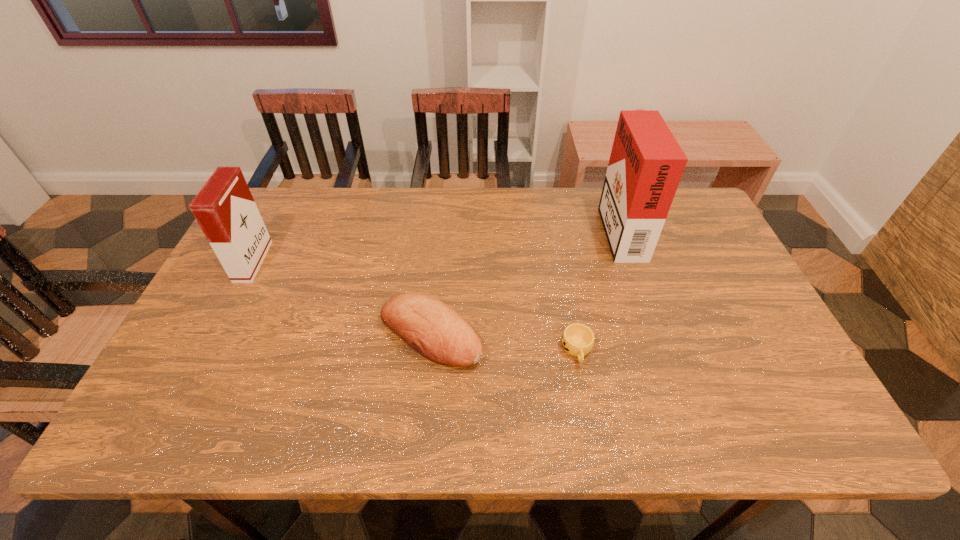
Point out which object is positioned as the third nearest to the bread. Please provide its 2D coordinates. Your answer should be formatted as a tuple, i.e. [(x, y)], where the tuple contains the x and y coordinates of a point satisfying the conditions above.

[(646, 164)]

Choose which object is the third nearest neighbor to the bread. Please provide its 2D coordinates. Your answer should be formatted as a tuple, i.e. [(x, y)], where the tuple contains the x and y coordinates of a point satisfying the conditions above.

[(646, 164)]

You are a GUI agent. You are given a task and a screenshot of the screen. Output one action in this format:
    pyautogui.click(x=<x>, y=<y>)
    Task: Click on the free space in the image that satisfies the following two spatial constraints: 1. on the front-facing side of the shorter cigarette_case; 2. on the left side of the shortest object
    
    Given the screenshot: What is the action you would take?
    pyautogui.click(x=207, y=350)

I want to click on vacant space that satisfies the following two spatial constraints: 1. on the front-facing side of the left cigarette_case; 2. on the left side of the cup, so click(207, 350).

This screenshot has width=960, height=540. I want to click on free location that satisfies the following two spatial constraints: 1. on the front-facing side of the left cigarette_case; 2. on the left side of the cup, so [207, 350].

This screenshot has height=540, width=960. I want to click on free space that satisfies the following two spatial constraints: 1. on the front-facing side of the second object from right to left; 2. on the right side of the shorter cigarette_case, so click(x=207, y=350).

This screenshot has height=540, width=960. In order to click on vacant point that satisfies the following two spatial constraints: 1. on the front-facing side of the left cigarette_case; 2. on the left side of the second object from left to right in this screenshot , I will do `click(215, 335)`.

This screenshot has width=960, height=540. I want to click on free space in the image that satisfies the following two spatial constraints: 1. on the front-facing side of the third object from left to right; 2. on the left side of the shorter cigarette_case, so click(x=207, y=350).

The height and width of the screenshot is (540, 960). What are the coordinates of `free point that satisfies the following two spatial constraints: 1. on the front-facing side of the second shortest object; 2. on the left side of the shorter cigarette_case` in the screenshot? It's located at (215, 335).